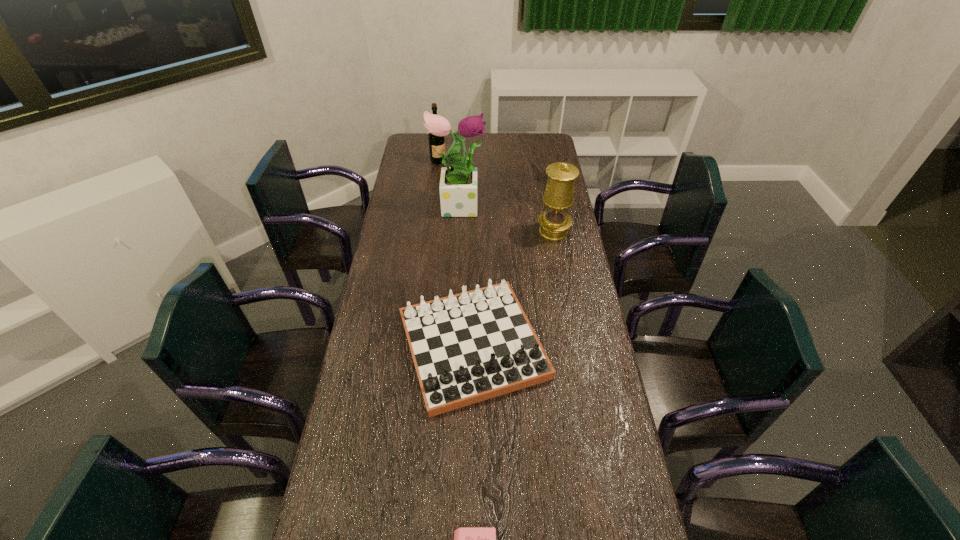
You are a GUI agent. You are given a task and a screenshot of the screen. Output one action in this format:
    pyautogui.click(x=<x>, y=<y>)
    Task: Click on the flower arrangement
    
    Given the screenshot: What is the action you would take?
    pyautogui.click(x=458, y=184)

Where is `oil lamp`? The image size is (960, 540). oil lamp is located at coordinates (554, 222).

The width and height of the screenshot is (960, 540). I want to click on the farthest object, so click(437, 142).

Find the location of a particular element. The image size is (960, 540). gameboard is located at coordinates (469, 347).

Find the location of a particular element. This screenshot has width=960, height=540. the fourth farthest object is located at coordinates (469, 347).

The width and height of the screenshot is (960, 540). Find the location of `vacant point located on the front-facing side of the tallest object`. vacant point located on the front-facing side of the tallest object is located at coordinates (555, 204).

You are a GUI agent. You are given a task and a screenshot of the screen. Output one action in this format:
    pyautogui.click(x=<x>, y=<y>)
    Task: Click on the free location located 0.120m on the back of the oil lamp
    
    Given the screenshot: What is the action you would take?
    click(x=549, y=204)

Find the location of `free space located 0.110m on the front-facing side of the liquor`. free space located 0.110m on the front-facing side of the liquor is located at coordinates tap(468, 161).

You are a GUI agent. You are given a task and a screenshot of the screen. Output one action in this format:
    pyautogui.click(x=<x>, y=<y>)
    Task: Click on the vacant space situated 0.150m on the front of the third nearest object
    
    Given the screenshot: What is the action you would take?
    pyautogui.click(x=471, y=471)

What are the coordinates of `liquor that is positioned at the left edge` in the screenshot? It's located at (437, 142).